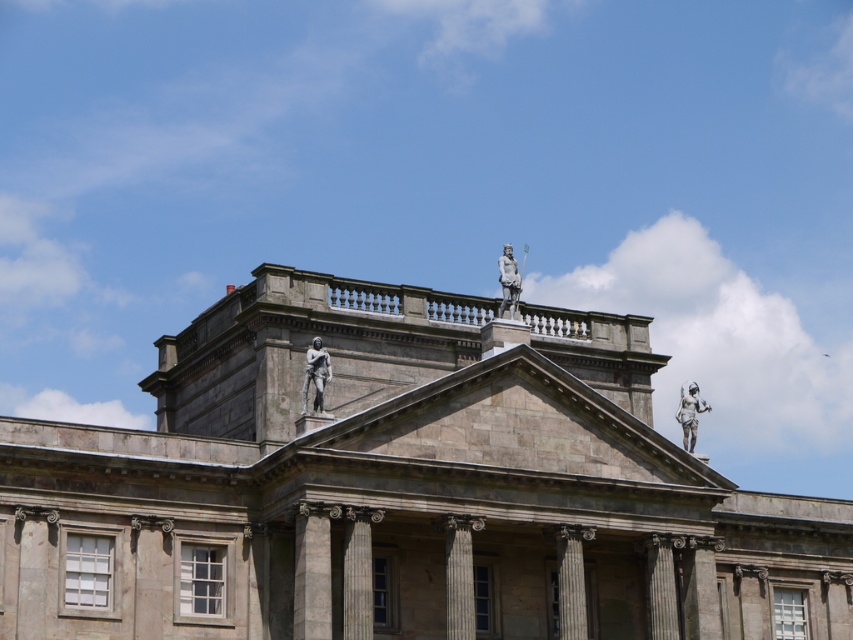
Question: Can you confirm if gray stone column at center is positioned to the right of polished bronze statue at upper center?

Choices:
 (A) yes
 (B) no

Answer: (B)

Question: Which of the following is the farthest from the observer?

Choices:
 (A) tap(582, 563)
 (B) tap(322, 352)

Answer: (A)

Question: Does polished bronze statue at upper right lie behind polished bronze statue at upper center?

Choices:
 (A) no
 (B) yes

Answer: (B)

Question: Is gray stone column at center wider than polished bronze statue at upper center?

Choices:
 (A) yes
 (B) no

Answer: (B)

Question: Estimate the real-world distances between objects in this image. Which object is farther from the gray stone column at center?

Choices:
 (A) polished bronze statue at upper center
 (B) gray stone statue at center

Answer: (A)

Question: Which object is the closest to the polished bronze statue at upper center?

Choices:
 (A) gray stone column at center
 (B) polished bronze statue at upper right

Answer: (A)